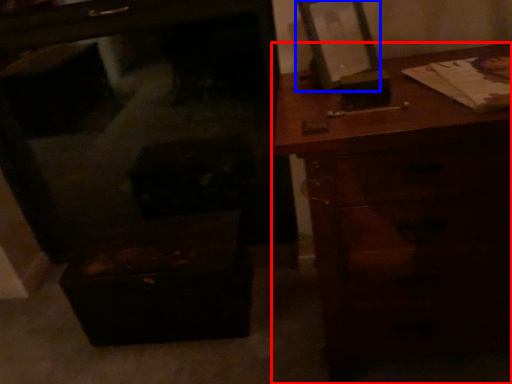
Question: Which of the following is the closest to the observer, chest of drawers (highlighted by a red box) or picture frame (highlighted by a blue box)?

Choices:
 (A) chest of drawers
 (B) picture frame

Answer: (A)